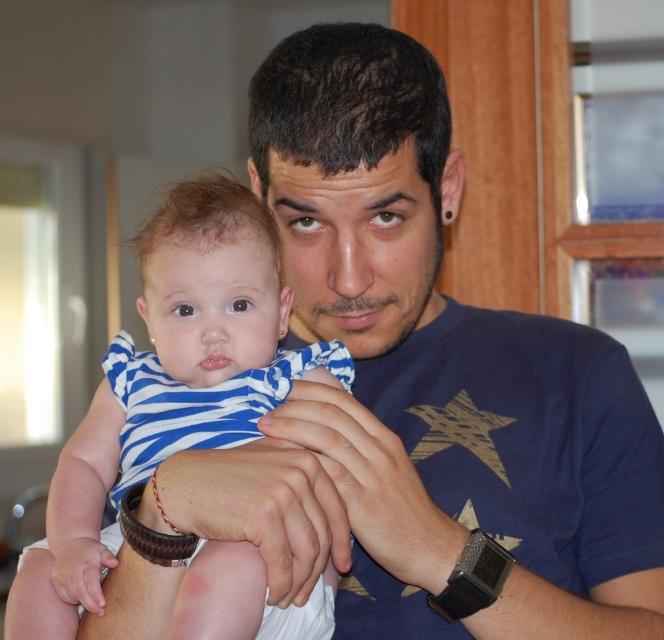
Question: Which of the following is the closest to the observer?

Choices:
 (A) black leather watch at center
 (B) blue striped fabric baby at center

Answer: (B)

Question: Can you confirm if blue striped fabric baby at center is thinner than black leather watch at center?

Choices:
 (A) no
 (B) yes

Answer: (B)

Question: Which point is farther to the camera?

Choices:
 (A) blue striped fabric baby at center
 (B) black leather watch at center

Answer: (B)

Question: Is blue striped fabric baby at center bigger than black leather watch at center?

Choices:
 (A) no
 (B) yes

Answer: (B)

Question: Is blue striped fabric baby at center further to camera compared to black leather watch at center?

Choices:
 (A) no
 (B) yes

Answer: (A)

Question: Which point is farther from the camera taking this photo?

Choices:
 (A) [x=288, y=621]
 (B) [x=625, y=532]

Answer: (B)